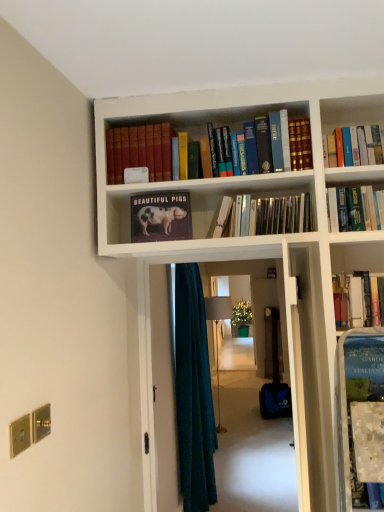
Question: From the image's perspective, is matte paper book at center, which appears as the fourth book when viewed from the right, above or below matte hardcover book at upper center, which is counted as the fifth book, starting from the right?

Choices:
 (A) below
 (B) above

Answer: (A)

Question: In the image, is matte paper book at center, which appears as the fourth book when viewed from the right, positioned in front of or behind matte hardcover book at upper center, which is counted as the fifth book, starting from the right?

Choices:
 (A) behind
 (B) front

Answer: (B)

Question: Estimate the real-world distances between objects in this image. Which object is farther from the matte paper book at center, which appears as the fourth book when viewed from the right?

Choices:
 (A) dark teal fabric at center
 (B) wooden door at center
 (C) matte hardcover book at upper center, which is counted as the fifth book, starting from the right
 (D) hardcover book at upper right, positioned as the fifth book in left-to-right order
 (E) metallic silver books at center, placed as the 4th book when sorted from left to right

Answer: (B)

Question: Based on their relative distances, which object is farther from the wooden door at center?

Choices:
 (A) hardcover book at center, placed as the third book when sorted from left to right
 (B) teal fabric screen door at center
 (C) matte paper book at center, which appears as the fourth book when viewed from the right
 (D) dark teal fabric at center
 (E) metallic silver books at center, placed as the 4th book when sorted from left to right

Answer: (C)